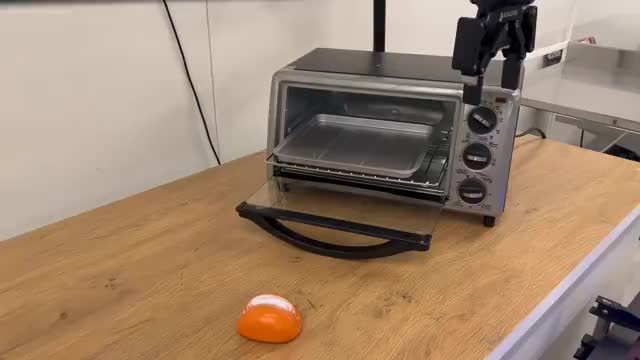
Locate an element on the screen. This screenshot has width=640, height=360. tray is located at coordinates (390, 149).